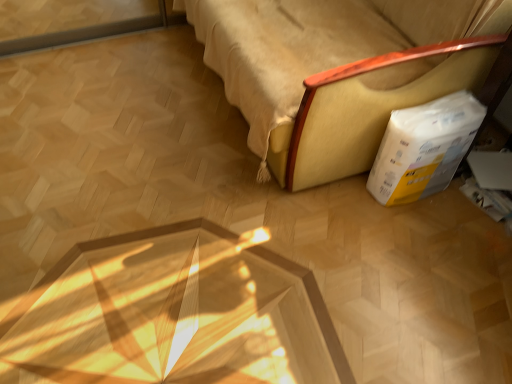
Locate an element on the screen. The height and width of the screenshot is (384, 512). vacant space in front of yellow fabric sofa at lower right is located at coordinates (270, 263).